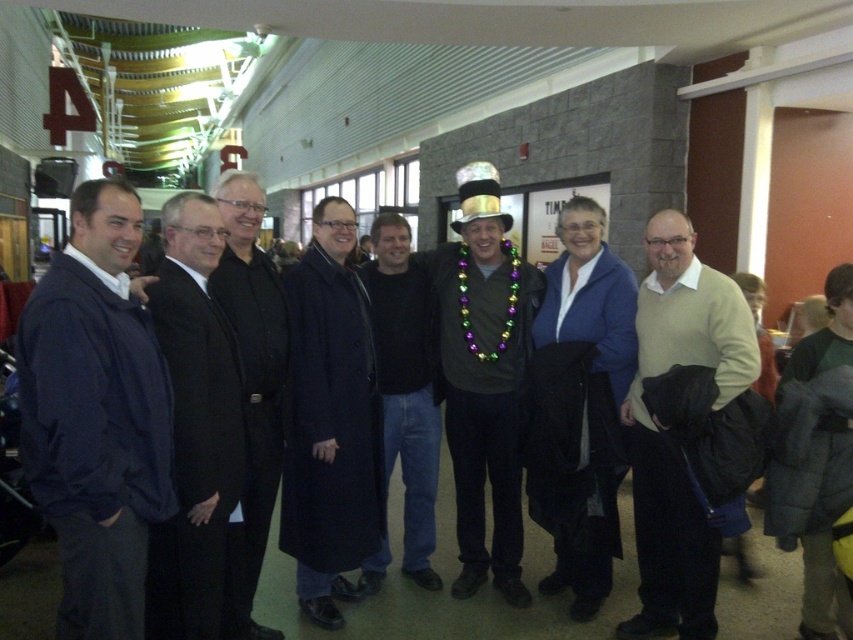
Does dark blue jacket at left have a lesser height compared to light beige sweater at center?

Correct, dark blue jacket at left is not as tall as light beige sweater at center.

Is dark blue jacket at left closer to the viewer compared to light beige sweater at center?

Yes, dark blue jacket at left is closer to the viewer.

Is point (53, 266) positioned in front of point (654, 513)?

Yes, it is in front of point (654, 513).

The width and height of the screenshot is (853, 640). I want to click on dark blue jacket at left, so click(96, 413).

Is dark blue jacket at left wider than black wool coat at center?

Indeed, dark blue jacket at left has a greater width compared to black wool coat at center.

Does dark blue jacket at left appear under black wool coat at center?

Incorrect, dark blue jacket at left is not positioned below black wool coat at center.

I want to click on dark blue jacket at left, so click(96, 413).

Find the location of a particular element. This screenshot has height=640, width=853. dark blue jacket at left is located at coordinates (96, 413).

In the scene shown: Does dark blue jacket at left appear on the right side of dark blue wool coat at center?

No, dark blue jacket at left is not to the right of dark blue wool coat at center.

Is dark blue jacket at left smaller than dark blue wool coat at center?

Correct, dark blue jacket at left occupies less space than dark blue wool coat at center.

The height and width of the screenshot is (640, 853). I want to click on dark blue jacket at left, so click(96, 413).